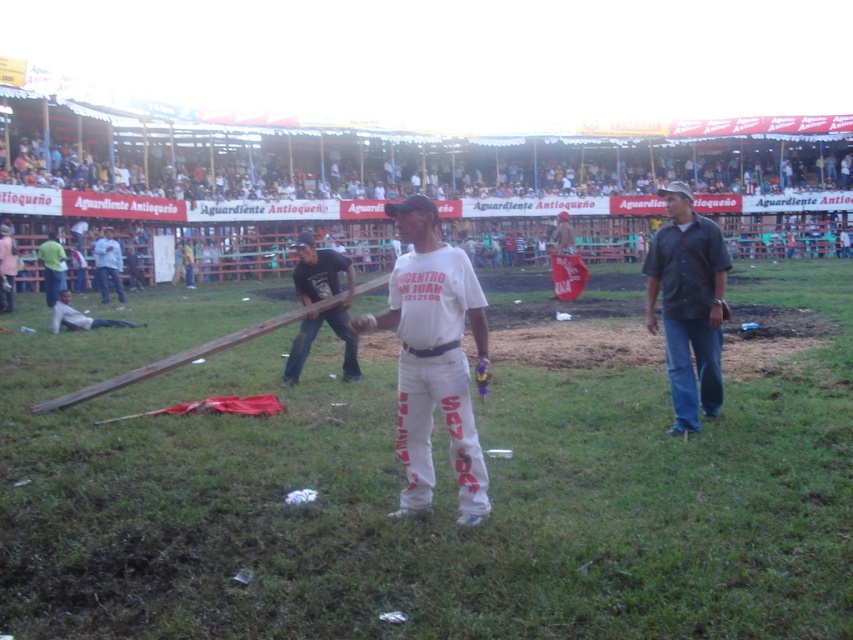
You are a photographer at the event and want to capture a photo that includes both the wooden pole at center and the dark blue shirt at right. Based on their positions, which object should you place on the left side of your photo frame?

The wooden pole at center should be placed on the left side of the photo frame because it is positioned on the left side of the dark blue shirt at right.